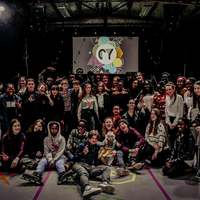
This screenshot has width=200, height=200. What are the coordinates of `light` in the screenshot? It's located at (2, 9).